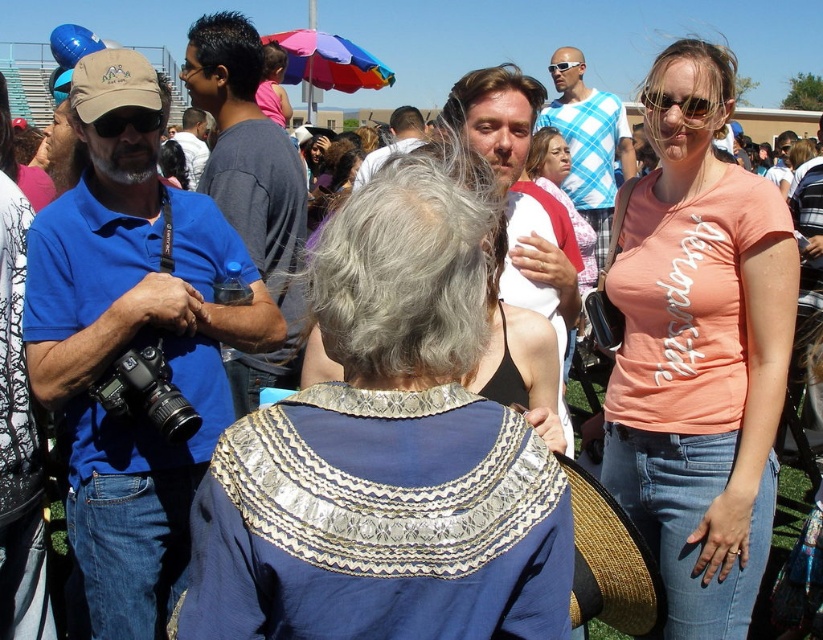
Does point (307, 285) lie behind point (758, 406)?

No.

This screenshot has width=823, height=640. In order to click on blue fabric dress at center in this screenshot , I will do `click(387, 451)`.

The image size is (823, 640). I want to click on blue fabric dress at center, so click(387, 451).

Between matte peach t-shirt at center and matte brown cap at upper left, which one is positioned lower?

matte peach t-shirt at center is lower down.

Is matte peach t-shirt at center closer to the viewer compared to matte brown cap at upper left?

Yes, matte peach t-shirt at center is closer to the viewer.

Image resolution: width=823 pixels, height=640 pixels. What are the coordinates of `matte peach t-shirt at center` in the screenshot? It's located at (700, 355).

Is blue fabric dress at center smaller than matte brown cap at upper left?

Actually, blue fabric dress at center might be larger than matte brown cap at upper left.

Measure the distance between blue fabric dress at center and matte brown cap at upper left.

blue fabric dress at center is 8.00 feet from matte brown cap at upper left.

This screenshot has width=823, height=640. What do you see at coordinates (387, 451) in the screenshot?
I see `blue fabric dress at center` at bounding box center [387, 451].

In order to click on blue fabric dress at center in this screenshot , I will do 387,451.